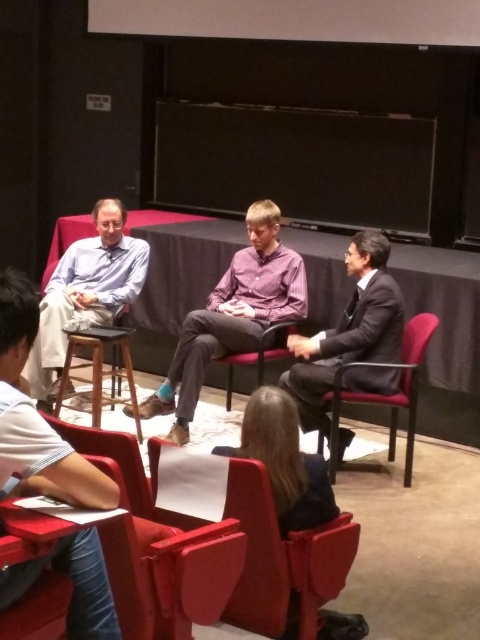
Question: Is matte blue shirt at center below dark gray suit at center?

Choices:
 (A) no
 (B) yes

Answer: (A)

Question: Does matte blue shirt at center appear on the right side of maroon fabric chair at right?

Choices:
 (A) no
 (B) yes

Answer: (A)

Question: Can you confirm if smooth leather chair at lower center is smaller than matte plastic chair at lower left?

Choices:
 (A) no
 (B) yes

Answer: (B)

Question: Which of the following is the farthest from the observer?

Choices:
 (A) light blue shirt at lower left
 (B) matte plastic chair at lower left
 (C) maroon fabric chair at right

Answer: (C)

Question: Which object is farther from the camera taking this photo?

Choices:
 (A) matte blue shirt at center
 (B) matte blue shirt at left

Answer: (B)

Question: Which object appears farthest from the camera in this image?

Choices:
 (A) smooth fabric chair at center
 (B) matte plastic chair at lower left

Answer: (A)